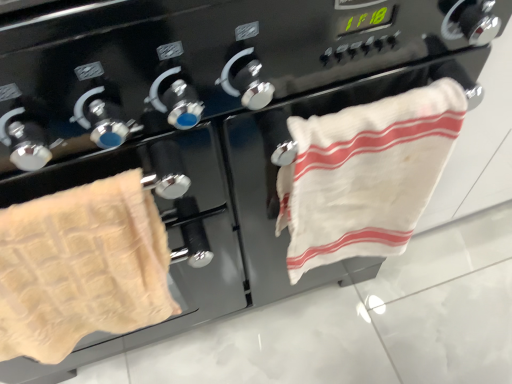
Question: Can we say beige waffle towel at left, acting as the 2th towel starting from the right, lies outside white cotton towel at right, which is counted as the 2th towel, starting from the left?

Choices:
 (A) no
 (B) yes

Answer: (B)

Question: Does beige waffle towel at left, acting as the 2th towel starting from the right, touch white cotton towel at right, which is the first towel from right to left?

Choices:
 (A) yes
 (B) no

Answer: (B)

Question: Is the depth of beige waffle towel at left, acting as the 2th towel starting from the right, greater than that of white cotton towel at right, which is the first towel from right to left?

Choices:
 (A) no
 (B) yes

Answer: (A)

Question: Can you confirm if beige waffle towel at left, which is the first towel in left-to-right order, is smaller than white cotton towel at right, which is the first towel from right to left?

Choices:
 (A) no
 (B) yes

Answer: (A)

Question: Can you confirm if beige waffle towel at left, acting as the 2th towel starting from the right, is wider than white cotton towel at right, which is the first towel from right to left?

Choices:
 (A) yes
 (B) no

Answer: (A)

Question: Can you confirm if beige waffle towel at left, which is the first towel in left-to-right order, is thinner than white cotton towel at right, which is the first towel from right to left?

Choices:
 (A) yes
 (B) no

Answer: (B)

Question: Can you confirm if white cotton towel at right, which is the first towel from right to left, is taller than beige waffle towel at left, which is the first towel in left-to-right order?

Choices:
 (A) yes
 (B) no

Answer: (A)

Question: Is beige waffle towel at left, which is the first towel in left-to-right order, located within white cotton towel at right, which is the first towel from right to left?

Choices:
 (A) yes
 (B) no

Answer: (B)

Question: Is white cotton towel at right, which is counted as the 2th towel, starting from the left, thinner than beige waffle towel at left, acting as the 2th towel starting from the right?

Choices:
 (A) no
 (B) yes

Answer: (B)

Question: From a real-world perspective, is white cotton towel at right, which is the first towel from right to left, on top of beige waffle towel at left, acting as the 2th towel starting from the right?

Choices:
 (A) yes
 (B) no

Answer: (B)

Question: Does white cotton towel at right, which is the first towel from right to left, have a greater width compared to beige waffle towel at left, acting as the 2th towel starting from the right?

Choices:
 (A) no
 (B) yes

Answer: (A)

Question: Does white cotton towel at right, which is the first towel from right to left, touch beige waffle towel at left, which is the first towel in left-to-right order?

Choices:
 (A) yes
 (B) no

Answer: (B)

Question: Looking at their shapes, would you say beige waffle towel at left, which is the first towel in left-to-right order, is wider or thinner than white cotton towel at right, which is the first towel from right to left?

Choices:
 (A) wide
 (B) thin

Answer: (A)